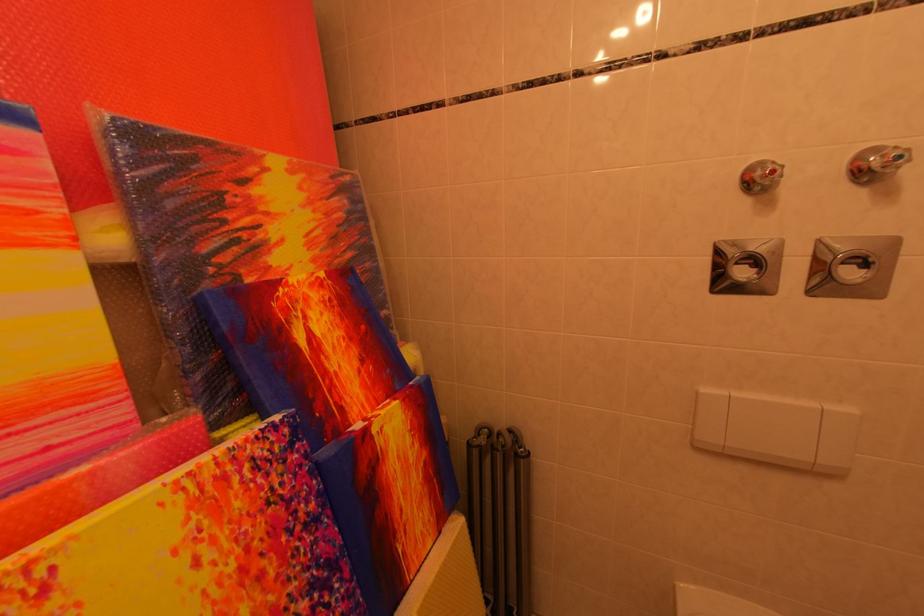
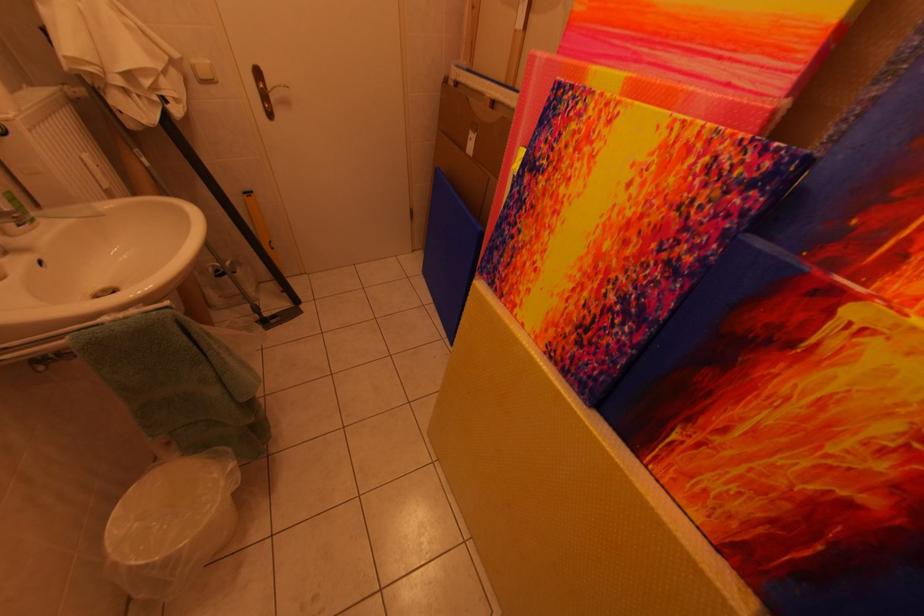
Locate, in the second image, the point that corresponds to [383,434] in the first image.

(861, 317)